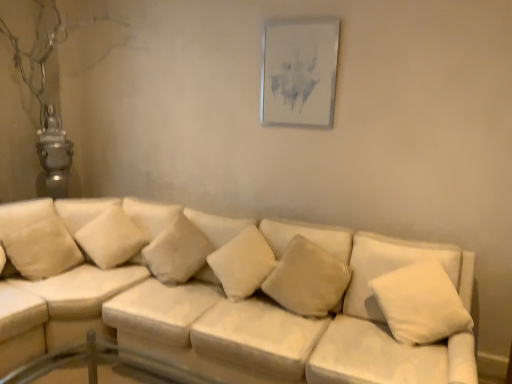
Question: Is transparent glass table at lower left turned away from metallic silver picture frame at upper center?

Choices:
 (A) yes
 (B) no

Answer: (B)

Question: From the image's perspective, is transparent glass table at lower left under metallic silver picture frame at upper center?

Choices:
 (A) no
 (B) yes

Answer: (B)

Question: Is the position of transparent glass table at lower left more distant than that of metallic silver picture frame at upper center?

Choices:
 (A) yes
 (B) no

Answer: (B)

Question: Considering the relative positions of transparent glass table at lower left and metallic silver picture frame at upper center in the image provided, is transparent glass table at lower left to the left of metallic silver picture frame at upper center from the viewer's perspective?

Choices:
 (A) no
 (B) yes

Answer: (B)

Question: Can you confirm if transparent glass table at lower left is taller than metallic silver picture frame at upper center?

Choices:
 (A) yes
 (B) no

Answer: (B)

Question: Can you confirm if transparent glass table at lower left is shorter than metallic silver picture frame at upper center?

Choices:
 (A) yes
 (B) no

Answer: (A)

Question: From a real-world perspective, is soft beige pillow at center, the second pillow viewed from the right, over white soft cushion at left, positioned as the first pillow in left-to-right order?

Choices:
 (A) no
 (B) yes

Answer: (B)

Question: Is soft beige pillow at center, the 5th pillow from the left, in contact with white soft cushion at left, which is the sixth pillow in right-to-left order?

Choices:
 (A) no
 (B) yes

Answer: (A)

Question: Considering the relative positions of soft beige pillow at center, the 5th pillow from the left, and white soft cushion at left, which is the sixth pillow in right-to-left order, in the image provided, is soft beige pillow at center, the 5th pillow from the left, to the right of white soft cushion at left, which is the sixth pillow in right-to-left order, from the viewer's perspective?

Choices:
 (A) no
 (B) yes

Answer: (B)

Question: Is soft beige pillow at center, the second pillow viewed from the right, aimed at white soft cushion at left, which is the sixth pillow in right-to-left order?

Choices:
 (A) yes
 (B) no

Answer: (B)

Question: Is soft beige pillow at center, the second pillow viewed from the right, looking in the opposite direction of white soft cushion at left, positioned as the first pillow in left-to-right order?

Choices:
 (A) yes
 (B) no

Answer: (B)

Question: Does soft beige pillow at center, the second pillow viewed from the right, have a lesser height compared to white soft cushion at left, which is the sixth pillow in right-to-left order?

Choices:
 (A) yes
 (B) no

Answer: (B)

Question: From the image's perspective, is soft beige pillow at center, the second pillow viewed from the right, on white fabric couch at center?

Choices:
 (A) no
 (B) yes

Answer: (B)